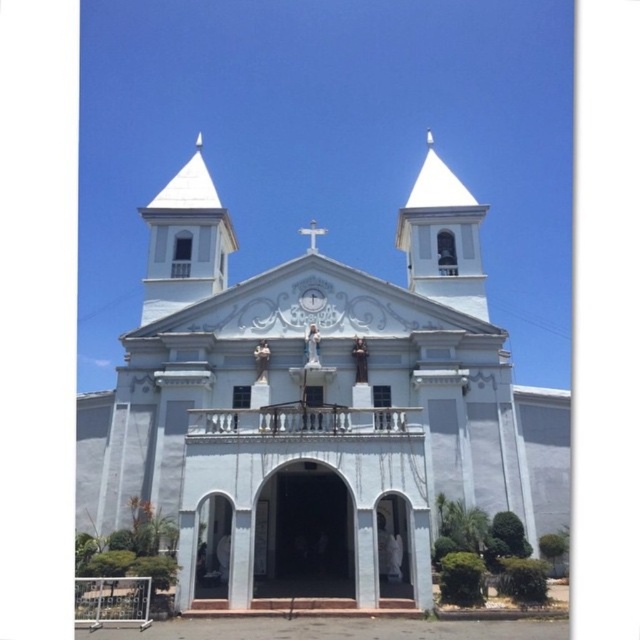
Question: Which point is farther to the camera?

Choices:
 (A) (308, 296)
 (B) (355, 483)

Answer: (A)

Question: Does white painted wood spire at upper left have a greater width compared to white marble bell tower at upper center?

Choices:
 (A) yes
 (B) no

Answer: (A)

Question: Among these points, which one is farthest from the camera?

Choices:
 (A) (483, 275)
 (B) (179, 273)
 (C) (160, 504)
 (D) (301, 301)

Answer: (B)

Question: Can you confirm if white painted wood spire at upper left is positioned below white marble cross at center?

Choices:
 (A) no
 (B) yes

Answer: (B)

Question: Which point is closer to the camera taking this photo?

Choices:
 (A) (323, 301)
 (B) (444, 408)

Answer: (B)

Question: Does white marble bell tower at upper center appear under white marble cross at center?

Choices:
 (A) yes
 (B) no

Answer: (B)